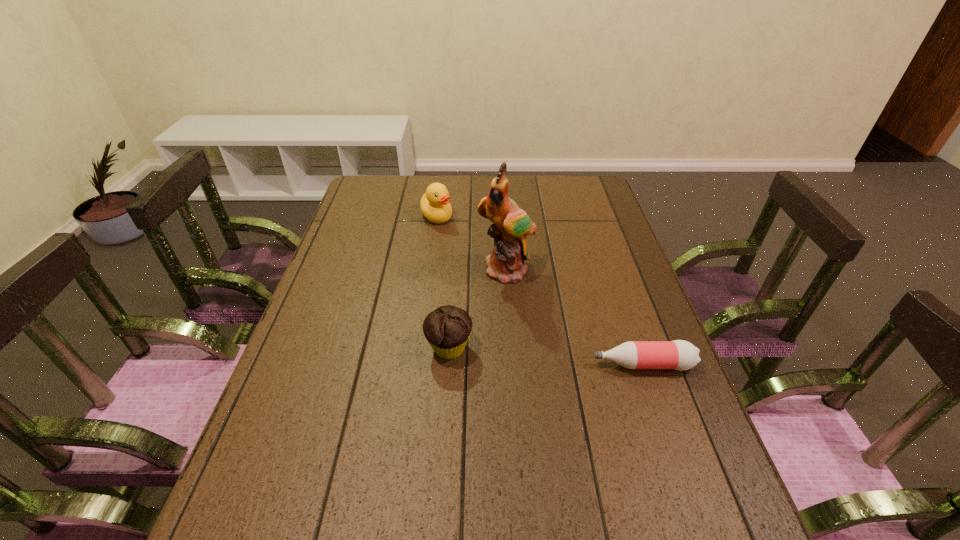
Where is `free space between the third tallest object and the shortest object`? This screenshot has height=540, width=960. free space between the third tallest object and the shortest object is located at coordinates (546, 356).

You are a GUI agent. You are given a task and a screenshot of the screen. Output one action in this format:
    pyautogui.click(x=<x>, y=<y>)
    Task: Click on the free space between the duck and the muffin
    This screenshot has height=540, width=960.
    Given the screenshot: What is the action you would take?
    pyautogui.click(x=443, y=282)

This screenshot has height=540, width=960. Identify the location of unoccupied area between the muffin and the duck. (443, 282).

Identify which object is the nearest to the muffin. Please provide its 2D coordinates. Your answer should be formatted as a tuple, i.e. [(x, y)], where the tuple contains the x and y coordinates of a point satisfying the conditions above.

[(511, 224)]

At what (x,y) coordinates should I click in order to perform the action: click on object that can be found as the third closest to the parrot. Please return your answer as a coordinate pair (x, y). The width and height of the screenshot is (960, 540). Looking at the image, I should click on (681, 355).

The image size is (960, 540). I want to click on free spot that satisfies the following two spatial constraints: 1. on the front side of the parrot; 2. on the right side of the farthest object, so click(x=429, y=271).

Find the location of a particular element. vacant area in the image that satisfies the following two spatial constraints: 1. on the front side of the duck; 2. on the left side of the second shortest object is located at coordinates (419, 348).

Identify the location of vacant point that satisfies the following two spatial constraints: 1. on the front side of the shortest object; 2. with the cap open on the duck. (417, 364).

Locate an element on the screen. The image size is (960, 540). free space that satisfies the following two spatial constraints: 1. on the front side of the shortest object; 2. with the cap open on the second tallest object is located at coordinates (x=417, y=364).

The width and height of the screenshot is (960, 540). I want to click on vacant space that satisfies the following two spatial constraints: 1. on the front side of the duck; 2. with the cap open on the bottle, so click(417, 364).